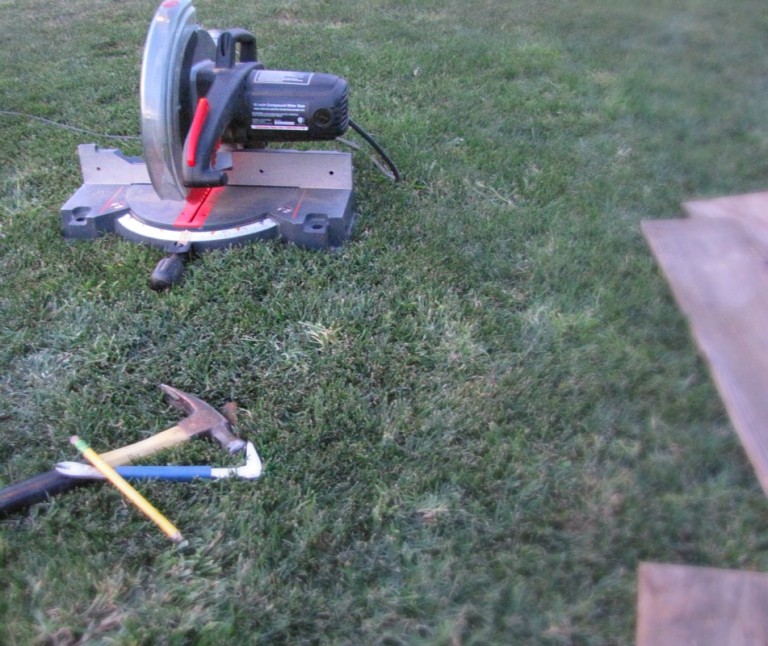
The height and width of the screenshot is (646, 768). Find the location of `plywood`. plywood is located at coordinates (725, 275), (753, 214), (703, 612).